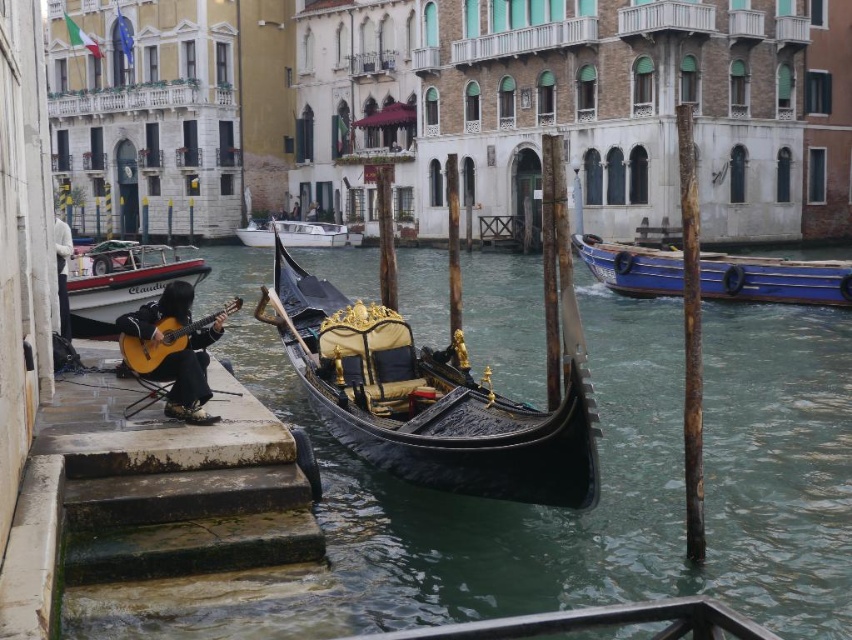
Question: Is black polished wood gondola at center positioned behind white fabric jacket at left?

Choices:
 (A) no
 (B) yes

Answer: (A)

Question: Is the position of transparent water at gondola center less distant than that of white fabric jacket at left?

Choices:
 (A) no
 (B) yes

Answer: (B)

Question: Which of these objects is positioned farthest from the blue wooden boat at right?

Choices:
 (A) white plastic boat at left
 (B) transparent water at gondola center
 (C) black polished wood gondola at center
 (D) white fabric jacket at left

Answer: (D)

Question: Can you confirm if white glossy boat at center is thinner than white fabric jacket at left?

Choices:
 (A) yes
 (B) no

Answer: (A)

Question: Estimate the real-world distances between objects in this image. Which object is closer to the black polished wood gondola at center?

Choices:
 (A) white plastic boat at left
 (B) white glossy boat at center
 (C) transparent water at gondola center

Answer: (C)

Question: Which object is farther from the camera taking this photo?

Choices:
 (A) white plastic boat at left
 (B) matte brown guitar at lower left

Answer: (A)